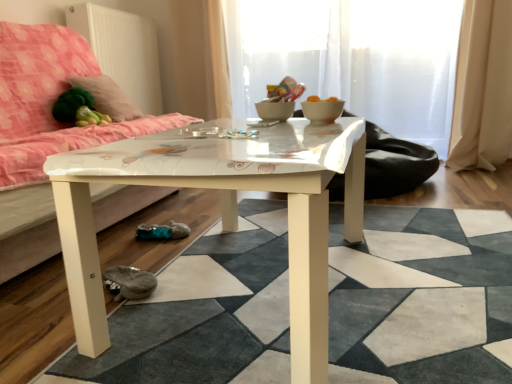
Where is `empty space that is ontop of white glossy table at center (from a real-world perspective)`? empty space that is ontop of white glossy table at center (from a real-world perspective) is located at coordinates (374, 275).